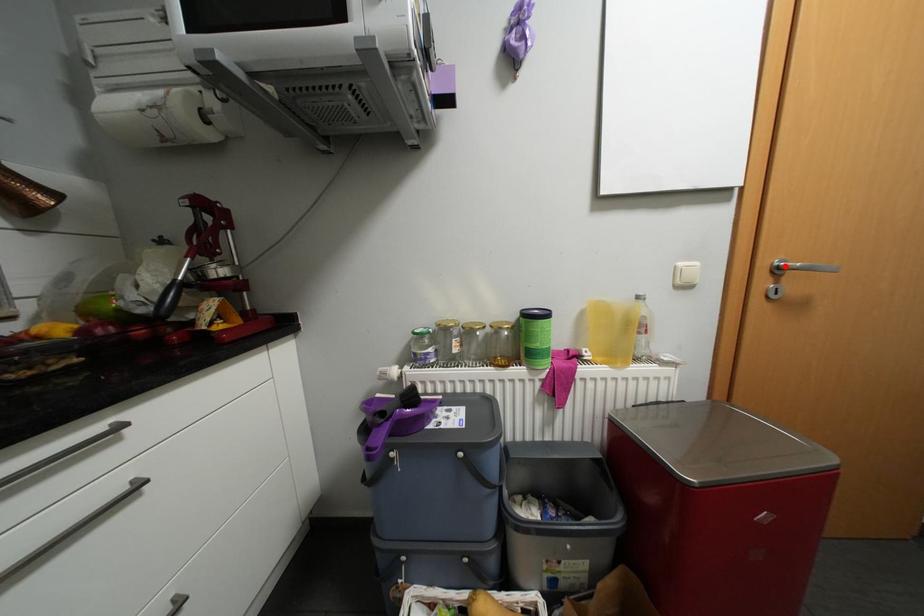
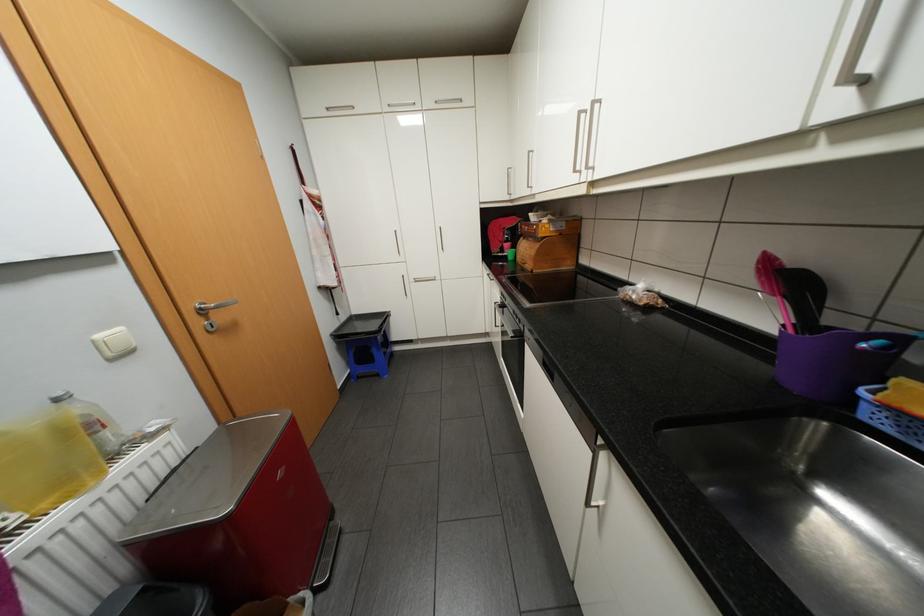
Locate, in the second image, the point that corresponds to the highlighted location in the first image.

(209, 308)